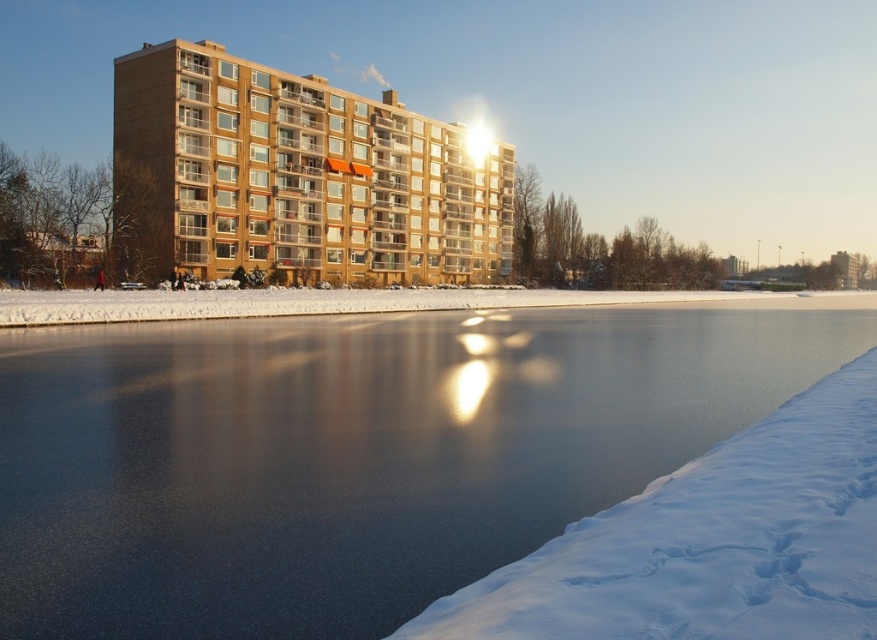
From the picture: Between smooth ice at lower center and white powdery snow at lower right, which one is positioned higher?

smooth ice at lower center is above.

Is smooth ice at lower center to the right of white powdery snow at lower right from the viewer's perspective?

In fact, smooth ice at lower center is to the left of white powdery snow at lower right.

Is point (216, 545) positioned in front of point (719, 627)?

No, it is not.

At what (x,y) coordinates should I click in order to perform the action: click on smooth ice at lower center. Please return your answer as a coordinate pair (x, y). The width and height of the screenshot is (877, 640). Looking at the image, I should click on (353, 452).

What do you see at coordinates (298, 177) in the screenshot? This screenshot has width=877, height=640. I see `brown glass building at center` at bounding box center [298, 177].

Between brown glass building at center and white powdery snow at lower right, which one appears on the left side from the viewer's perspective?

Positioned to the left is brown glass building at center.

Describe the element at coordinates (298, 177) in the screenshot. The height and width of the screenshot is (640, 877). I see `brown glass building at center` at that location.

You are a GUI agent. You are given a task and a screenshot of the screen. Output one action in this format:
    pyautogui.click(x=<x>, y=<y>)
    Task: Click on the brown glass building at center
    This screenshot has height=640, width=877.
    Given the screenshot: What is the action you would take?
    pyautogui.click(x=298, y=177)

Which is above, smooth ice at lower center or brown glass building at center?

brown glass building at center

Is point (448, 392) positioned before point (302, 278)?

Yes, it is in front of point (302, 278).

Identify the location of smooth ice at lower center. (353, 452).